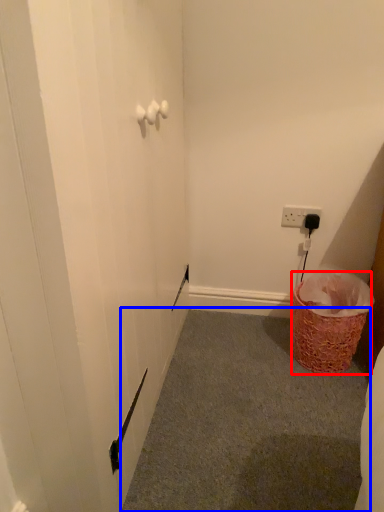
Question: Which point is closer to the camera, basket (highlighted by a red box) or plain (highlighted by a blue box)?

Choices:
 (A) basket
 (B) plain

Answer: (B)